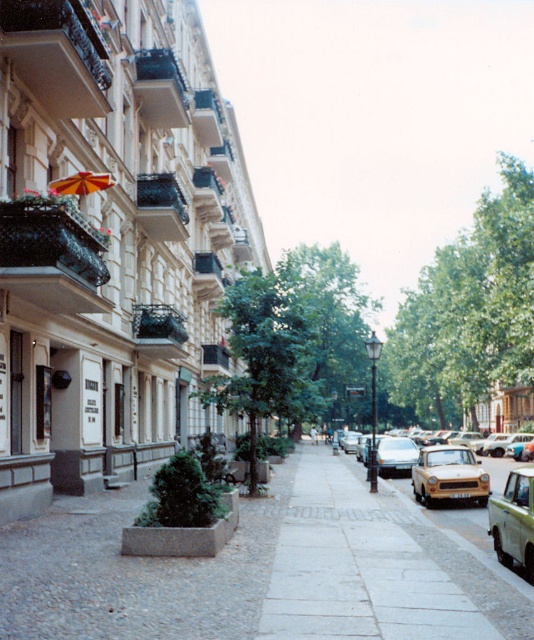
Question: Which of the following is the closest to the observer?

Choices:
 (A) smooth concrete sidewalk at center
 (B) green matte car at right
 (C) orange fabric umbrella at upper left
 (D) matte yellow car at center-right

Answer: (A)

Question: Does beige matte taxi at lower right appear on the left side of matte yellow car at center-right?

Choices:
 (A) no
 (B) yes

Answer: (B)

Question: Which of the following is the closest to the observer?

Choices:
 (A) (78, 195)
 (B) (490, 577)

Answer: (B)

Question: In this image, where is green matte car at right located relative to beige matte taxi at lower right?

Choices:
 (A) right
 (B) left

Answer: (B)

Question: Which of the following is the closest to the observer?

Choices:
 (A) (505, 544)
 (B) (414, 452)

Answer: (A)

Question: Does smooth concrete sidewalk at center have a larger size compared to orange fabric umbrella at upper left?

Choices:
 (A) no
 (B) yes

Answer: (B)